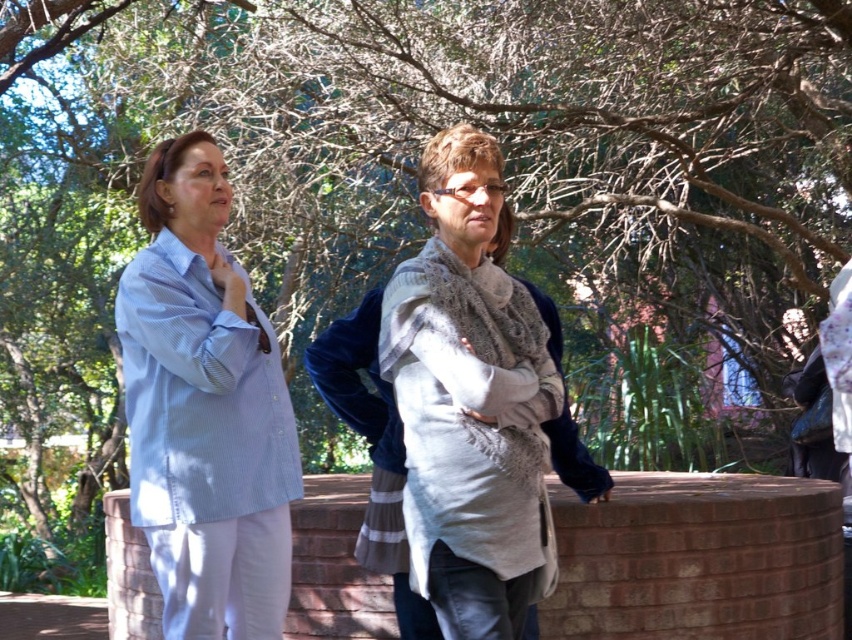
Can you confirm if light blue striped shirt at left is wider than knitted gray scarf at center?

Indeed, light blue striped shirt at left has a greater width compared to knitted gray scarf at center.

Who is lower down, light blue striped shirt at left or knitted gray scarf at center?

light blue striped shirt at left

Which is behind, point (167, 556) or point (435, 156)?

Point (167, 556)

This screenshot has width=852, height=640. I want to click on light blue striped shirt at left, so click(x=204, y=410).